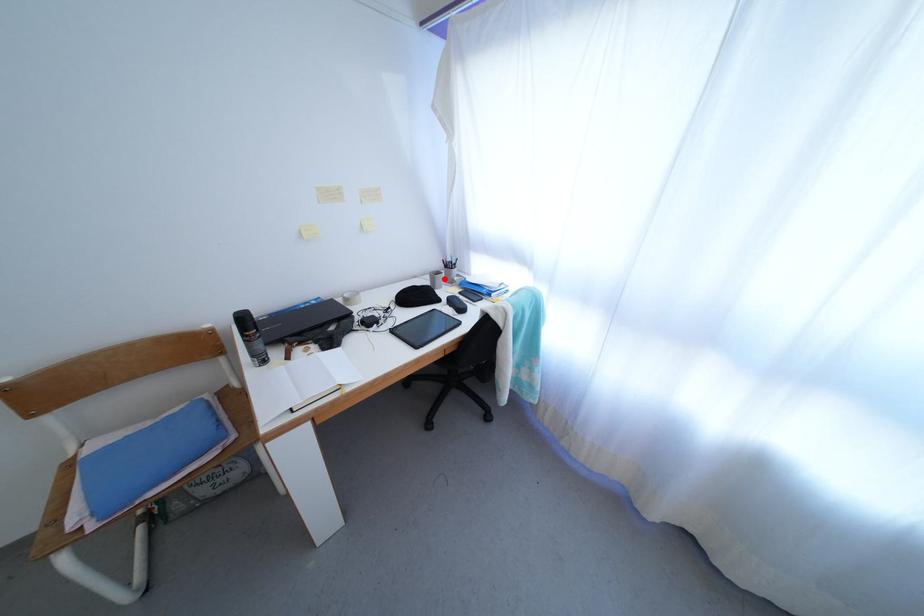
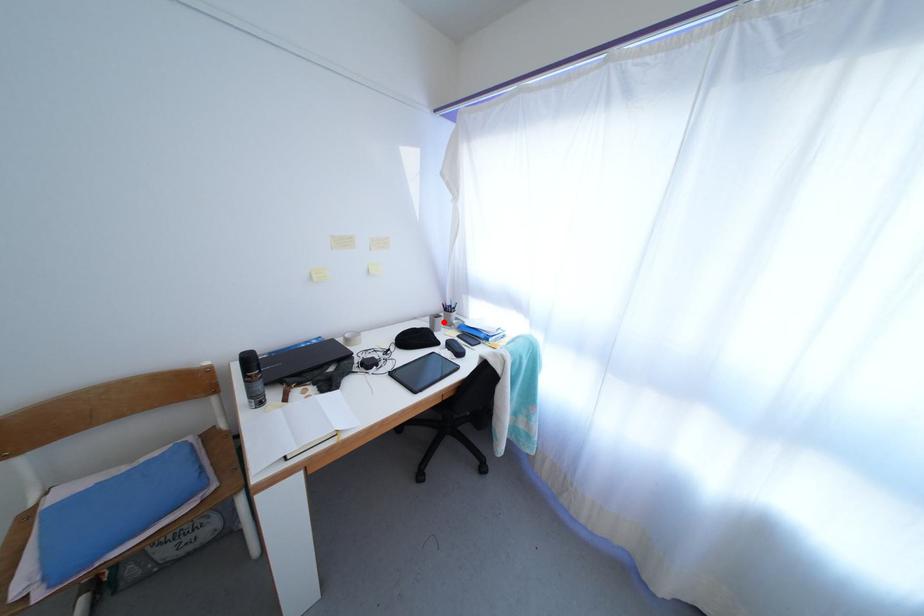
I am providing you with two images of the same scene from different viewpoints. A red point is marked on the first image and another point is marked on the second image. Is the marked point in image1 the same physical position as the marked point in image2?

Yes